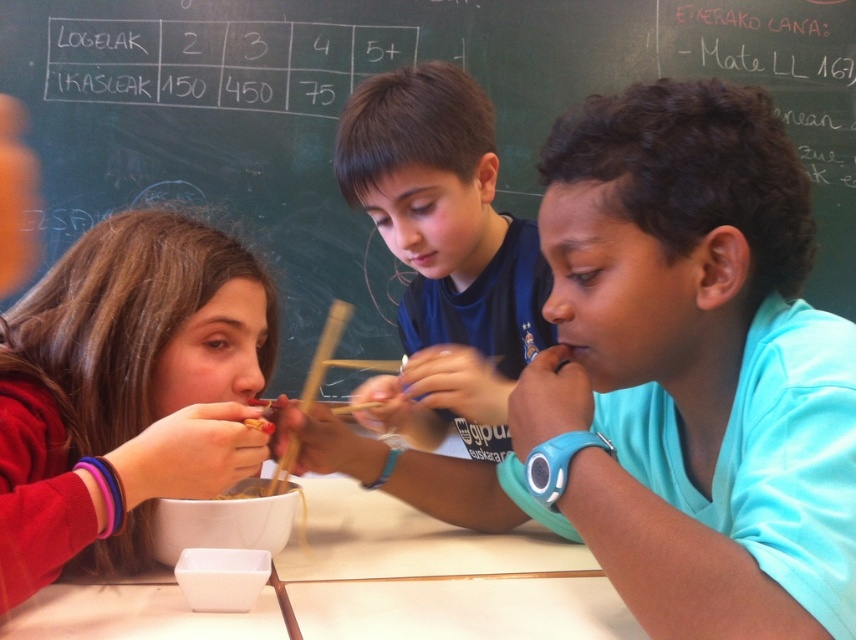
Question: Observing the image, what is the correct spatial positioning of black chalkboard at upper center in reference to dark blue shirt at center?

Choices:
 (A) below
 (B) above

Answer: (B)

Question: Is black chalkboard at upper center closer to the viewer compared to dark blue shirt at center?

Choices:
 (A) no
 (B) yes

Answer: (A)

Question: Among these points, which one is nearest to the camera?

Choices:
 (A) (611, 42)
 (B) (117, 440)
 (C) (770, 531)

Answer: (C)

Question: Can you confirm if blue shirt at center is positioned above black chalkboard at upper center?

Choices:
 (A) yes
 (B) no

Answer: (B)

Question: Which point is farther from the camera taking this photo?

Choices:
 (A) (697, 618)
 (B) (490, 218)
 (C) (107, 218)
 (D) (306, 74)

Answer: (D)

Question: Which object is the farthest from the blue shirt at center?

Choices:
 (A) matte red sweater at left
 (B) black chalkboard at upper center
 (C) dark blue shirt at center

Answer: (B)